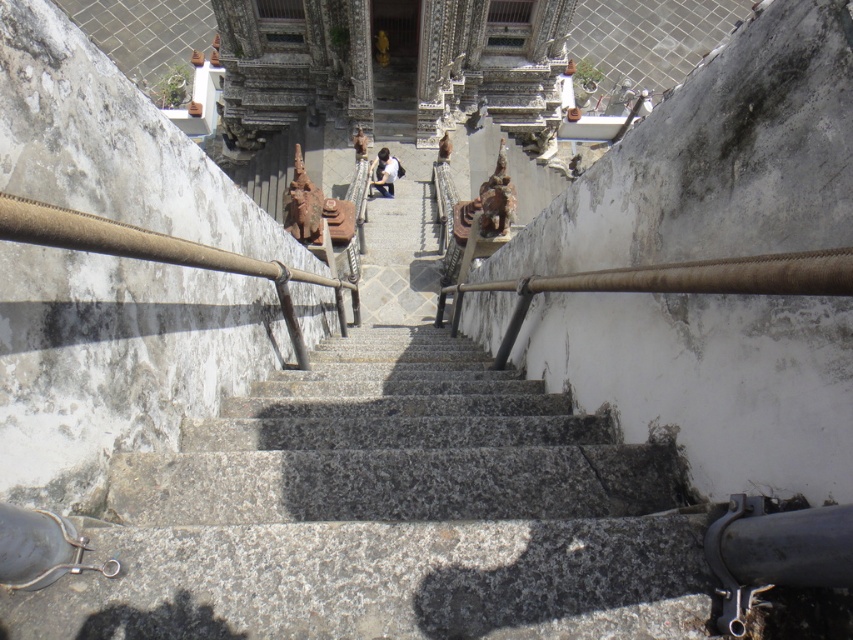
Question: Among these points, which one is farthest from the camera?

Choices:
 (A) (155, 454)
 (B) (387, 156)
 (C) (444, 156)

Answer: (B)

Question: Does white matte shirt at center appear on the right side of smooth brown statue at center?

Choices:
 (A) yes
 (B) no

Answer: (B)

Question: Can you confirm if white matte shirt at center is positioned above smooth brown statue at center?

Choices:
 (A) no
 (B) yes

Answer: (A)

Question: Among these points, which one is nearest to the camera?

Choices:
 (A) (397, 168)
 (B) (440, 147)
 (C) (456, 394)

Answer: (C)

Question: In this image, where is granite stairs at center located relative to white matte shirt at center?

Choices:
 (A) left
 (B) right

Answer: (B)

Question: Estimate the real-world distances between objects in this image. Which object is closer to the granite stairs at center?

Choices:
 (A) white matte shirt at center
 (B) smooth brown statue at center

Answer: (B)